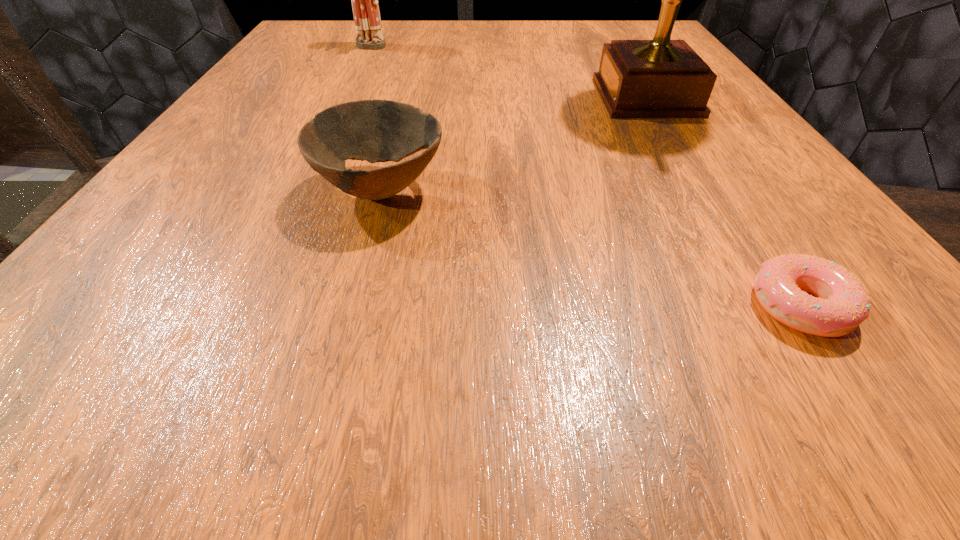
Where is `vacant space situated 0.080m on the plaque of the award`? The width and height of the screenshot is (960, 540). vacant space situated 0.080m on the plaque of the award is located at coordinates (550, 97).

This screenshot has height=540, width=960. In order to click on free space located on the front-facing side of the second tallest object in this screenshot , I will do `click(329, 132)`.

Find the location of a particular element. The image size is (960, 540). vacant region located on the back of the second nearest object is located at coordinates (418, 55).

Where is `vacant space located 0.270m on the left of the nearest object`? The image size is (960, 540). vacant space located 0.270m on the left of the nearest object is located at coordinates (483, 306).

Locate an element on the screen. Image resolution: width=960 pixels, height=540 pixels. object that is at the far edge is located at coordinates (366, 13).

You are a GUI agent. You are given a task and a screenshot of the screen. Output one action in this format:
    pyautogui.click(x=<x>, y=<y>)
    Task: Click on the object situated at the near edge
    
    Given the screenshot: What is the action you would take?
    pyautogui.click(x=843, y=303)

You are a GUI agent. You are given a task and a screenshot of the screen. Output one action in this format:
    pyautogui.click(x=<x>, y=<y>)
    Task: Click on the object present at the left edge
    The height and width of the screenshot is (540, 960).
    Given the screenshot: What is the action you would take?
    pyautogui.click(x=366, y=13)

In order to click on award that is at the right edge in this screenshot , I will do `click(661, 78)`.

Identify the location of doughnut that is positioned at the right edge. (843, 303).

I want to click on object present at the far left corner, so click(x=366, y=13).